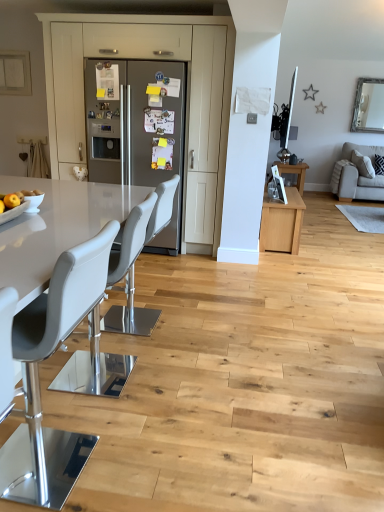
Locate an element on the screen. The image size is (384, 512). vacant space to the right of gray leather bar stool at center, the second chair from the front is located at coordinates (181, 378).